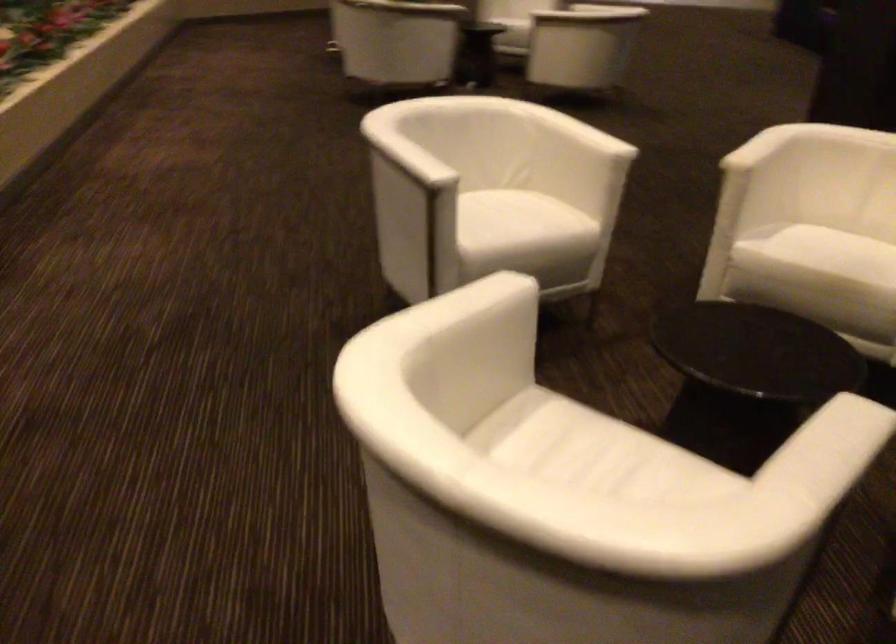
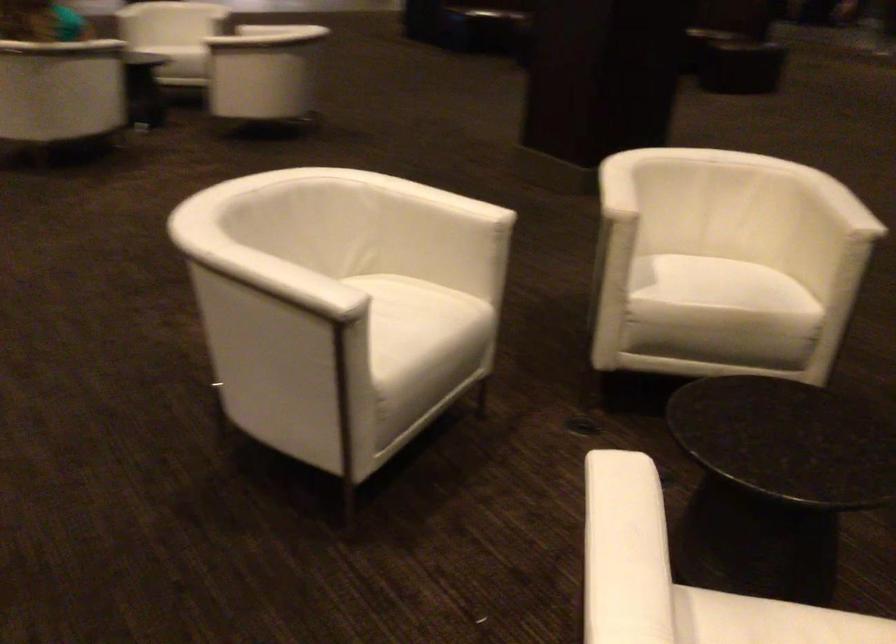
Question: The camera is either moving clockwise (left) or counter-clockwise (right) around the object. The first image is from the beginning of the video and the second image is from the end. Is the camera moving left or right when shooting the video?

Choices:
 (A) Left
 (B) Right

Answer: (A)